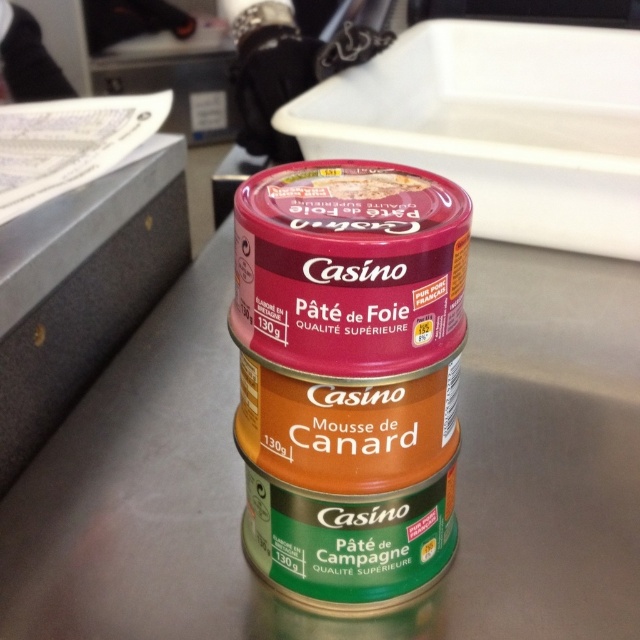
Between green matte can at center and matte plastic pâté at center, which one appears on the right side from the viewer's perspective?

Positioned to the right is green matte can at center.

Identify the location of green matte can at center. This screenshot has width=640, height=640. (349, 385).